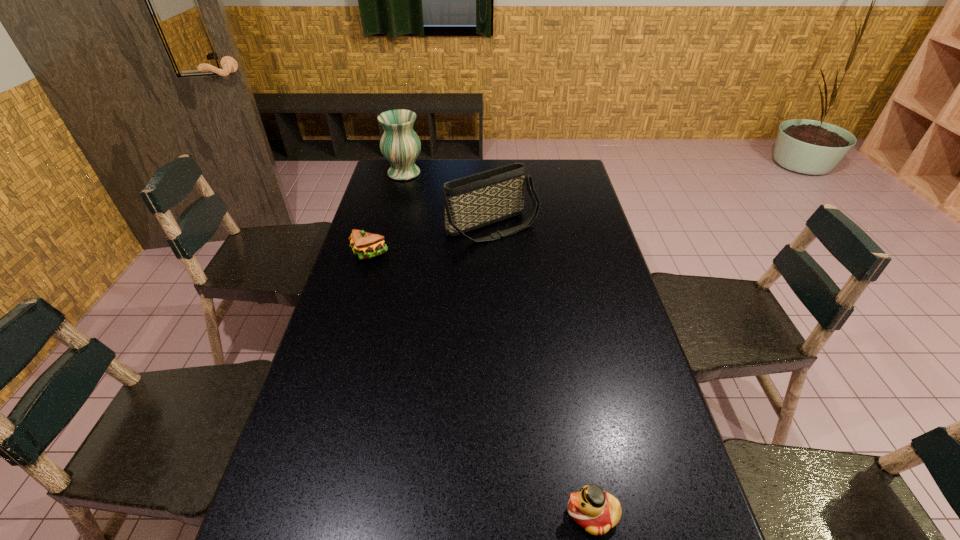
You are a GUI agent. You are given a task and a screenshot of the screen. Output one action in this format:
    pyautogui.click(x=<x>, y=<y>)
    Task: Click on the vacant area between the vase and the sandwich
    
    Given the screenshot: What is the action you would take?
    pyautogui.click(x=387, y=214)

The image size is (960, 540). In order to click on free spot between the second tallest object and the sandwich in this screenshot , I will do `click(431, 240)`.

I want to click on vacant area that lies between the sandwich and the vase, so click(x=387, y=214).

Identify the location of vacant region between the tallest object and the nearest object. The image size is (960, 540). tap(498, 343).

You are a GUI agent. You are given a task and a screenshot of the screen. Output one action in this format:
    pyautogui.click(x=<x>, y=<y>)
    Task: Click on the free area in between the second tallest object and the sandwich
    
    Given the screenshot: What is the action you would take?
    pyautogui.click(x=431, y=240)

This screenshot has width=960, height=540. Find the location of `free spot between the nearest object and the farthest object`. free spot between the nearest object and the farthest object is located at coordinates (498, 343).

Locate an element on the screen. The image size is (960, 540). free spot between the farthest object and the sandwich is located at coordinates (387, 214).

Find the location of a particular element. The image size is (960, 540). free space that is in between the sandwich and the handbag is located at coordinates (431, 240).

Where is `the third closest object to the farthest object`? The width and height of the screenshot is (960, 540). the third closest object to the farthest object is located at coordinates (595, 510).

Identify which object is the third closest to the duck. Please provide its 2D coordinates. Your answer should be formatted as a tuple, i.e. [(x, y)], where the tuple contains the x and y coordinates of a point satisfying the conditions above.

[(400, 145)]